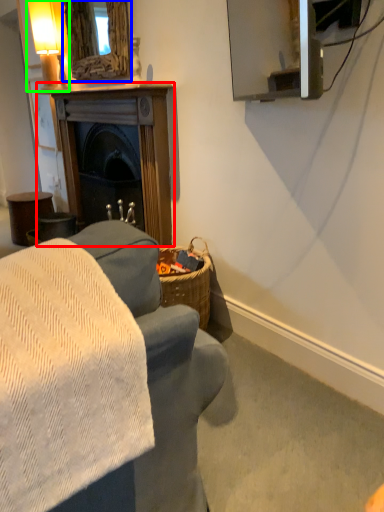
Question: Estimate the real-world distances between objects in this image. Which object is closer to fireplace (highlighted by a red box), mirror (highlighted by a blue box) or table lamp (highlighted by a green box)?

Choices:
 (A) mirror
 (B) table lamp

Answer: (A)